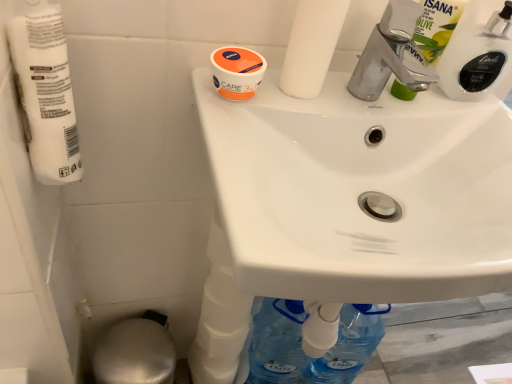
Locate an element on the screen. Image resolution: width=512 pixels, height=384 pixels. vacant space positioned to the left of green plastic bottle at upper right, positioned as the 1th cleaning product in left-to-right order is located at coordinates (331, 100).